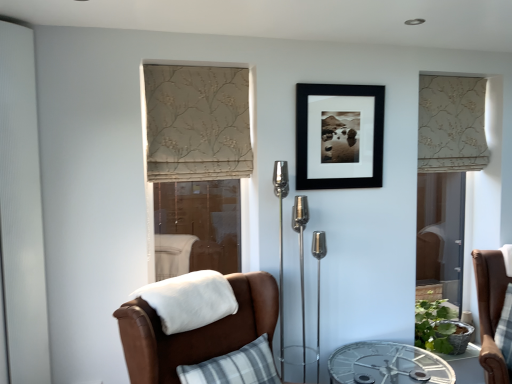
Question: Should I look upward or downward to see white textured screen door at left, the 1th screen door when ordered from left to right?

Choices:
 (A) up
 (B) down

Answer: (B)

Question: Which direction should I rotate to look at transparent glass screen door at center, which is the 2th screen door from front to back, — up or down?

Choices:
 (A) down
 (B) up

Answer: (A)

Question: Is white textured screen door at left, the 1th screen door when ordered from left to right, wider than clear glass screen door at right, the first screen door positioned from the right?

Choices:
 (A) no
 (B) yes

Answer: (B)

Question: Would you say clear glass screen door at right, which is the 3th screen door in front-to-back order, is part of white textured screen door at left, the 1th screen door when ordered from left to right,'s contents?

Choices:
 (A) yes
 (B) no

Answer: (B)

Question: From the image's perspective, is white textured screen door at left, which is the third screen door in back-to-front order, on top of clear glass screen door at right, which is the 3th screen door in front-to-back order?

Choices:
 (A) no
 (B) yes

Answer: (B)

Question: Is white textured screen door at left, which is the third screen door in back-to-front order, not inside clear glass screen door at right, the 3th screen door viewed from the left?

Choices:
 (A) no
 (B) yes

Answer: (B)

Question: Is white textured screen door at left, which is the third screen door in back-to-front order, taller than clear glass screen door at right, the first screen door positioned from the right?

Choices:
 (A) yes
 (B) no

Answer: (A)

Question: Can you see white textured screen door at left, which is the third screen door in back-to-front order, touching clear glass screen door at right, arranged as the 1th screen door when viewed from the back?

Choices:
 (A) no
 (B) yes

Answer: (A)

Question: Is black matte picture frame at center a part of clear glass screen door at right, which is the 3th screen door in front-to-back order?

Choices:
 (A) no
 (B) yes

Answer: (A)

Question: From the image's perspective, is clear glass screen door at right, the 3th screen door viewed from the left, under black matte picture frame at center?

Choices:
 (A) yes
 (B) no

Answer: (A)

Question: Is the position of clear glass screen door at right, which is the 3th screen door in front-to-back order, less distant than that of black matte picture frame at center?

Choices:
 (A) yes
 (B) no

Answer: (B)

Question: From a real-world perspective, is clear glass screen door at right, the first screen door positioned from the right, under black matte picture frame at center?

Choices:
 (A) yes
 (B) no

Answer: (A)

Question: Considering the relative sizes of clear glass screen door at right, the first screen door positioned from the right, and black matte picture frame at center in the image provided, is clear glass screen door at right, the first screen door positioned from the right, taller than black matte picture frame at center?

Choices:
 (A) yes
 (B) no

Answer: (A)

Question: Considering the relative sizes of clear glass screen door at right, the first screen door positioned from the right, and black matte picture frame at center in the image provided, is clear glass screen door at right, the first screen door positioned from the right, smaller than black matte picture frame at center?

Choices:
 (A) yes
 (B) no

Answer: (B)

Question: Is clear glass table at center positioned beyond the bounds of beige floral fabric curtain at right, which is the 2th curtain in left-to-right order?

Choices:
 (A) yes
 (B) no

Answer: (A)